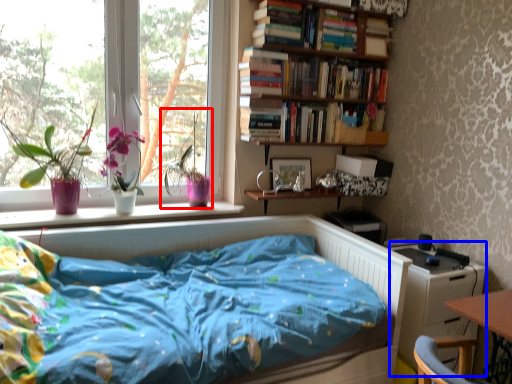
Question: Which object appears farthest to the camera in this image, floral arrangement (highlighted by a red box) or dresser (highlighted by a blue box)?

Choices:
 (A) floral arrangement
 (B) dresser

Answer: (A)